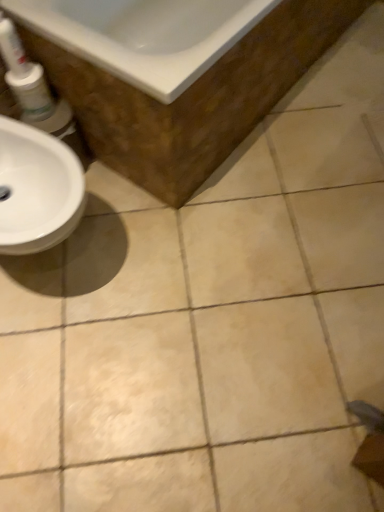
Question: From a real-world perspective, is white glossy tube at upper left positioned over white glossy bathtub at upper left based on gravity?

Choices:
 (A) no
 (B) yes

Answer: (B)

Question: Is white glossy tube at upper left not inside white glossy bathtub at upper left?

Choices:
 (A) no
 (B) yes

Answer: (B)

Question: Is white glossy tube at upper left positioned far away from white glossy bathtub at upper left?

Choices:
 (A) yes
 (B) no

Answer: (B)

Question: Can you confirm if white glossy tube at upper left is thinner than white glossy bathtub at upper left?

Choices:
 (A) yes
 (B) no

Answer: (A)

Question: Is white glossy tube at upper left in front of white glossy bathtub at upper left?

Choices:
 (A) yes
 (B) no

Answer: (B)

Question: Could you tell me if white glossy tube at upper left is facing white glossy bathtub at upper left?

Choices:
 (A) yes
 (B) no

Answer: (B)

Question: Is white glossy mouthwash at left oriented towards white glossy tube at upper left?

Choices:
 (A) no
 (B) yes

Answer: (A)

Question: Is white glossy mouthwash at left beside white glossy tube at upper left?

Choices:
 (A) no
 (B) yes

Answer: (B)

Question: Does white glossy mouthwash at left have a greater height compared to white glossy tube at upper left?

Choices:
 (A) no
 (B) yes

Answer: (A)

Question: Is the position of white glossy mouthwash at left more distant than that of white glossy tube at upper left?

Choices:
 (A) no
 (B) yes

Answer: (B)

Question: Would you say white glossy mouthwash at left contains white glossy tube at upper left?

Choices:
 (A) yes
 (B) no

Answer: (B)

Question: Does white glossy mouthwash at left have a lesser height compared to white glossy tube at upper left?

Choices:
 (A) yes
 (B) no

Answer: (A)

Question: Considering the relative sizes of white glossy tube at upper left and white glossy mouthwash at left in the image provided, is white glossy tube at upper left smaller than white glossy mouthwash at left?

Choices:
 (A) yes
 (B) no

Answer: (A)